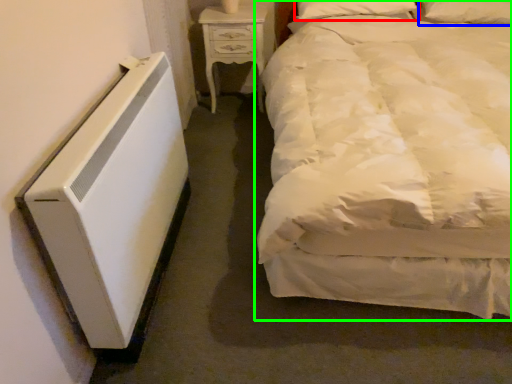
Question: Considering the real-world distances, which object is closest to pillow (highlighted by a red box)? pillow (highlighted by a blue box) or bed (highlighted by a green box).

Choices:
 (A) pillow
 (B) bed

Answer: (A)